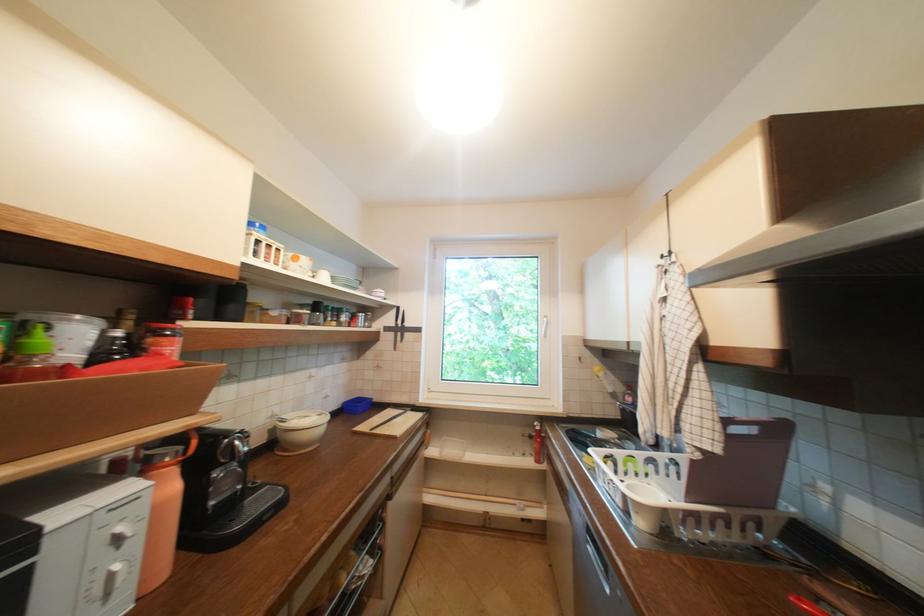
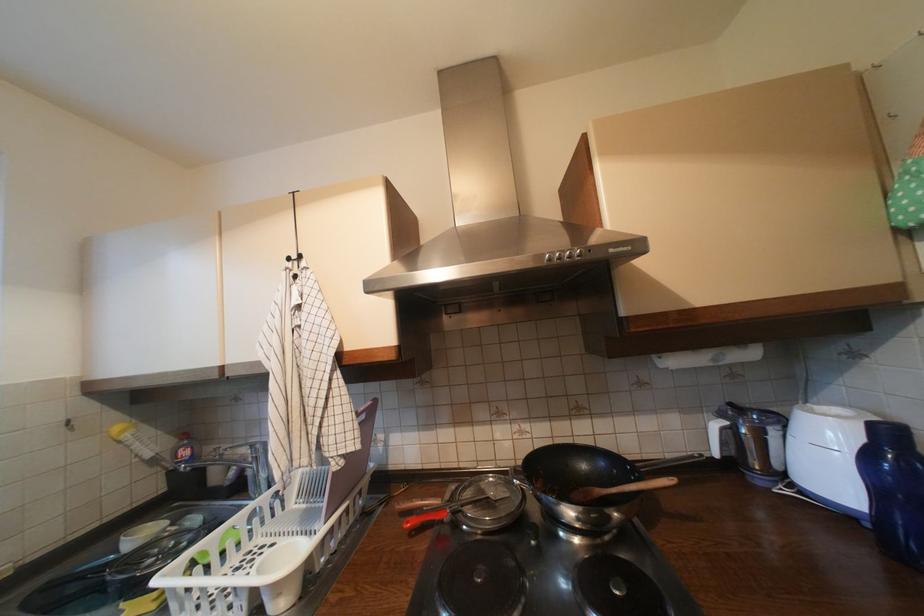
The point at (820, 582) is marked in the first image. Where is the corresponding point in the second image?

(407, 506)